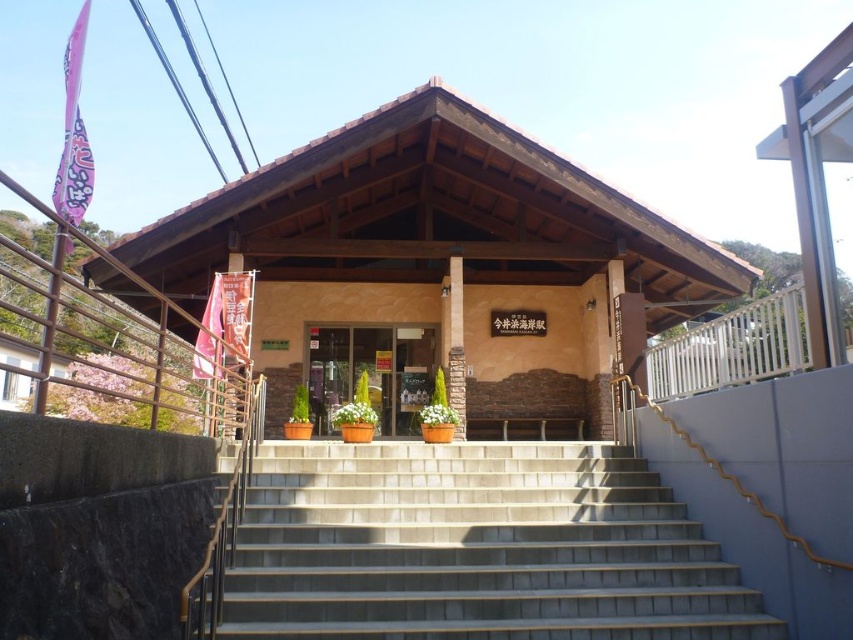
Question: Does gray concrete stairs at center appear on the left side of metallic brown railing at left?

Choices:
 (A) yes
 (B) no

Answer: (B)

Question: Can you confirm if gray concrete stairs at center is positioned to the left of metallic brown railing at left?

Choices:
 (A) no
 (B) yes

Answer: (A)

Question: Which point is closer to the camera taking this photo?

Choices:
 (A) (454, 321)
 (B) (94, 364)

Answer: (B)

Question: Which object appears farthest from the camera in this image?

Choices:
 (A) gray concrete stairs at center
 (B) brown wooden pillar at center
 (C) matte brown door at center

Answer: (C)

Question: Can you confirm if metallic brown railing at left is thinner than brown wooden pillar at center?

Choices:
 (A) no
 (B) yes

Answer: (A)

Question: Which point is closer to the camera?

Choices:
 (A) (196, 403)
 (B) (486, 470)

Answer: (B)